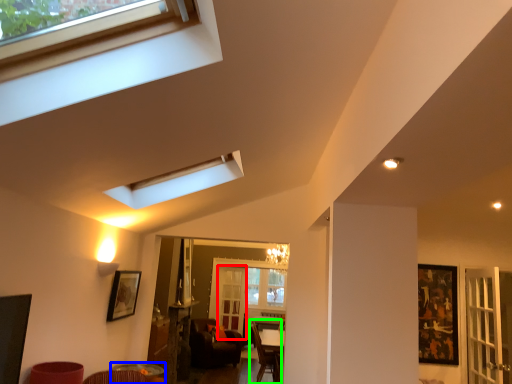
Question: Based on their relative distances, which object is farther from screen door (highlighted by a red box)? Choose from table (highlighted by a blue box) and armchair (highlighted by a green box).

Choices:
 (A) table
 (B) armchair

Answer: (A)